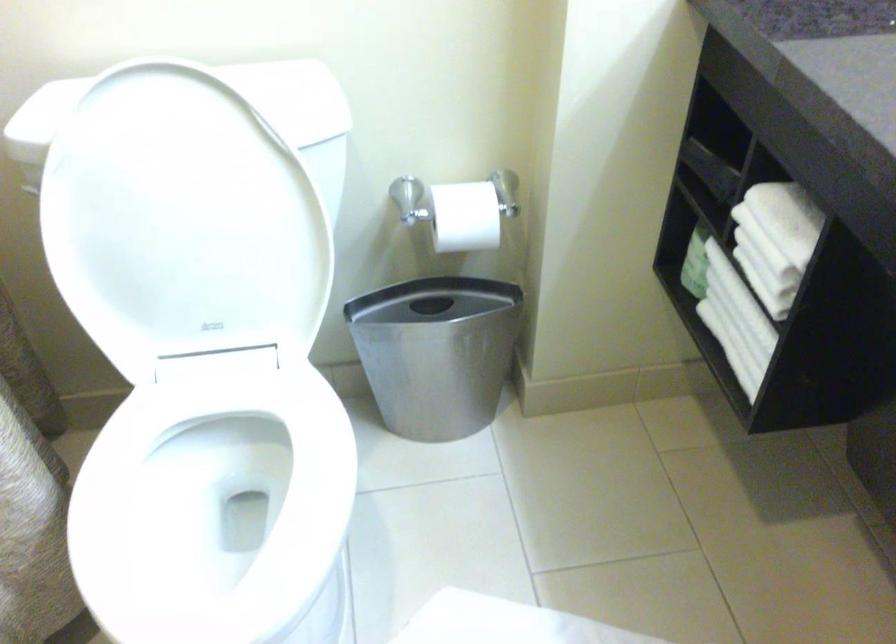
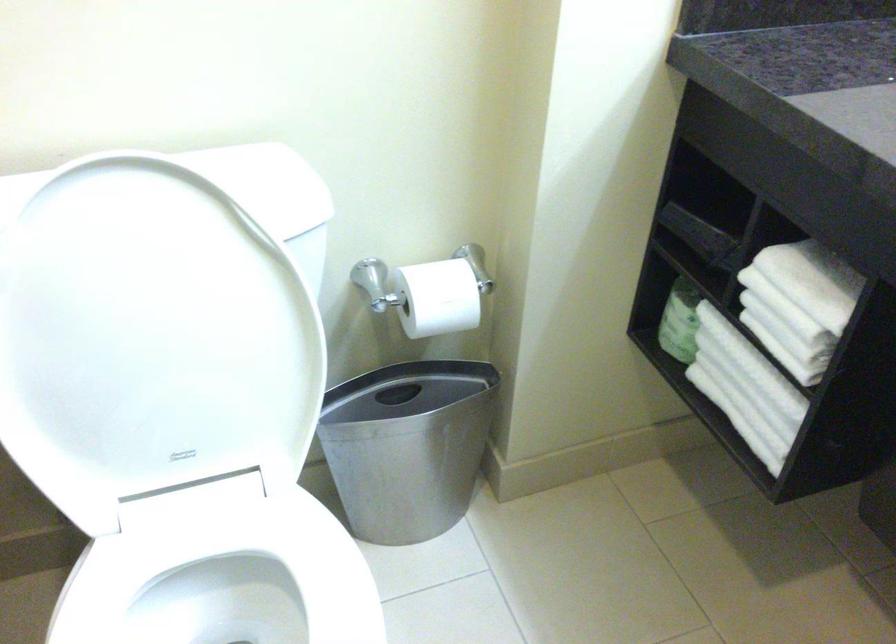
Locate, in the second image, the point that corresponds to point (782, 216) in the first image.

(806, 281)